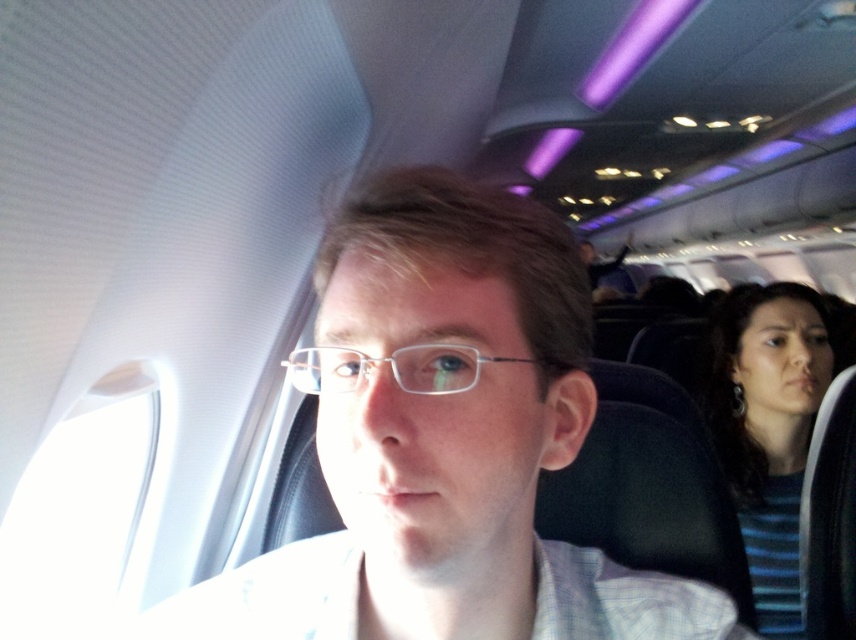
You are a passenger sitting in the airplane cabin and want to reach the two points mentioned in the scene. Which point, point [230,608] or point [423,381], is closer to you?

Point [230,608] is closer to you because it is further to the viewer than point [423,381].

You are a flight attendant checking the seating area. You notice the matte white shirt at center and the clear plastic glasses at center. Which object is positioned higher in the image?

The matte white shirt at center is much taller than clear plastic glasses at center, so the matte white shirt at center is positioned higher in the image.

You are a flight attendant carrying a 1.2 meter long tray. You need to place the tray between the blue striped shirt at right and the clear plastic glasses at center. Is there enough space to fit the tray horizontally between them?

The blue striped shirt at right and clear plastic glasses at center are 1.28 meters apart from each other. Since the tray is 1.2 meters long, there is enough space to fit the tray horizontally between them as the distance between them is slightly larger than the tray length.